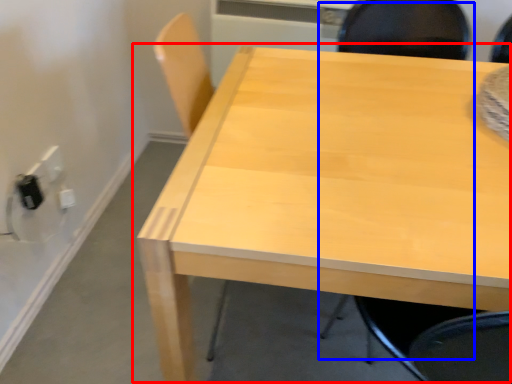
Question: Which object is closer to the camera taking this photo, table (highlighted by a red box) or chair (highlighted by a blue box)?

Choices:
 (A) table
 (B) chair

Answer: (B)